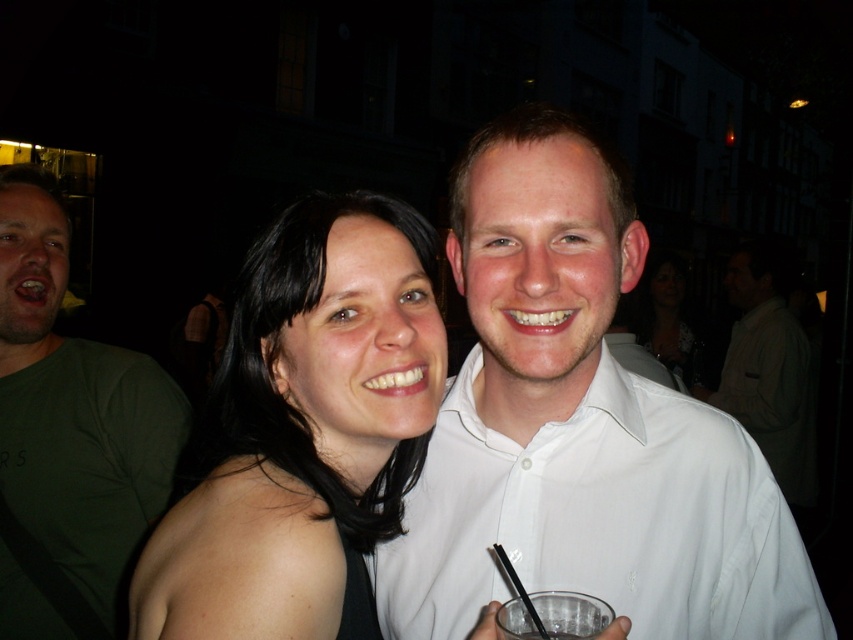
Question: Among these points, which one is nearest to the camera?

Choices:
 (A) (653, 308)
 (B) (549, 616)
 (C) (56, 532)
 (D) (724, 401)

Answer: (B)

Question: Does green cotton t-shirt at left appear on the left side of matte black hair at center?

Choices:
 (A) yes
 (B) no

Answer: (A)

Question: Observing the image, what is the correct spatial positioning of white smooth shirt at upper center in reference to green cotton t-shirt at left?

Choices:
 (A) above
 (B) below

Answer: (B)

Question: Which object is positioned farthest from the white cotton shirt at upper right?

Choices:
 (A) matte black hair at center
 (B) black matte hair at center
 (C) green cotton t-shirt at left
 (D) white smooth shirt at upper center

Answer: (B)

Question: Does black matte hair at center appear under matte black hair at center?

Choices:
 (A) no
 (B) yes

Answer: (B)

Question: Which object is closer to the camera taking this photo?

Choices:
 (A) matte black hair at center
 (B) black matte hair at center

Answer: (B)